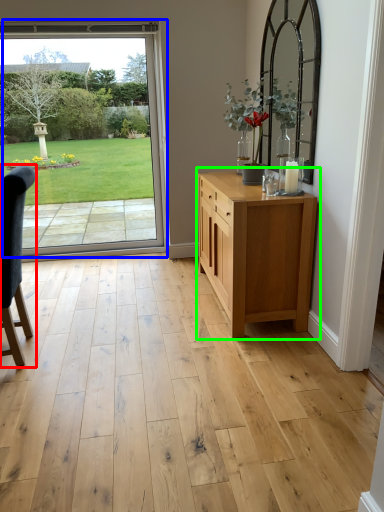
Question: Which object is positioned closest to chair (highlighted by a red box)? Select from door (highlighted by a blue box) and chest of drawers (highlighted by a green box).

Choices:
 (A) door
 (B) chest of drawers

Answer: (B)